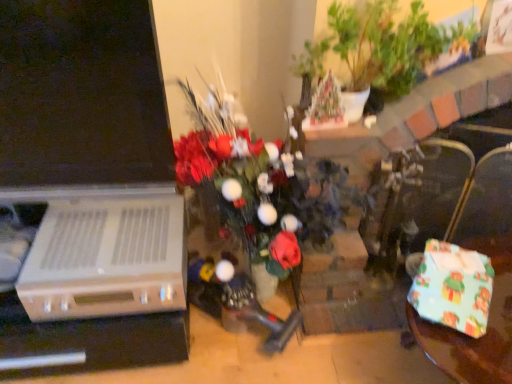
Locate an element on the screen. The image size is (512, 384). blank space above wrapping paper gift at lower right (from a real-world perspective) is located at coordinates (445, 275).